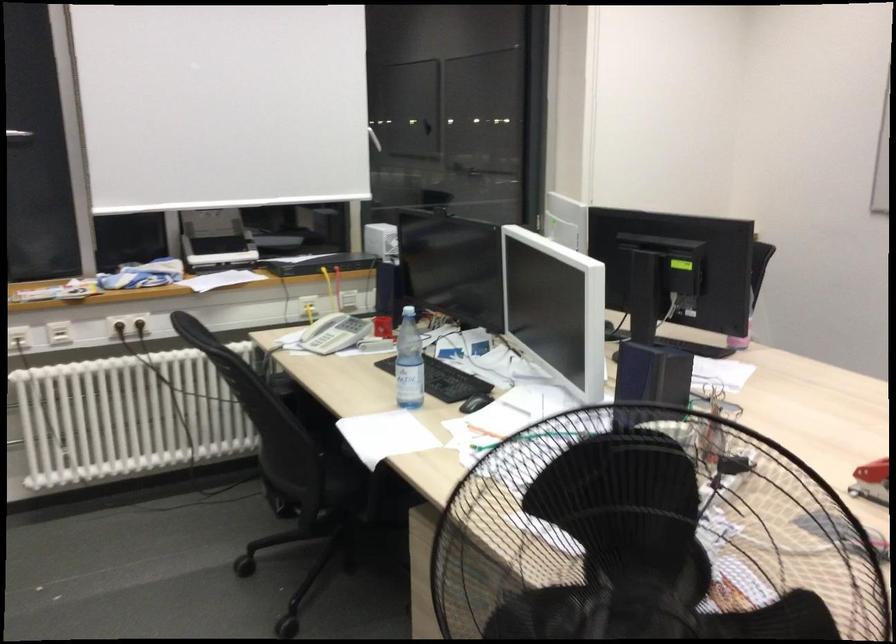
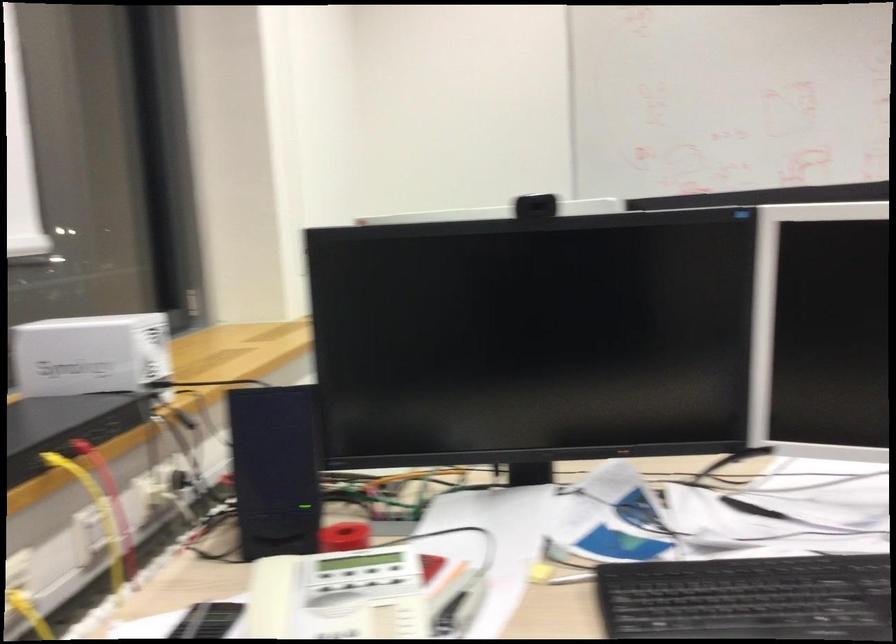
The point at (x=346, y=319) is marked in the first image. Where is the corresponding point in the second image?

(352, 581)